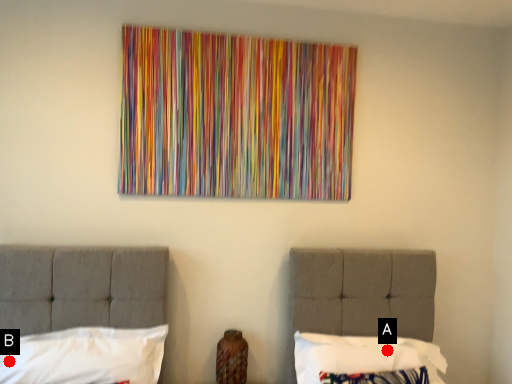
Question: Two points are circled on the image, labeled by A and B beside each circle. Which point is further to the camera?

Choices:
 (A) A is further
 (B) B is further

Answer: (A)